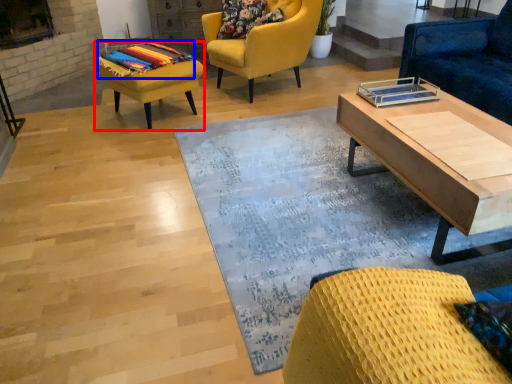
Question: Which point is further to the camera, stool (highlighted by a red box) or blanket (highlighted by a blue box)?

Choices:
 (A) stool
 (B) blanket

Answer: (B)